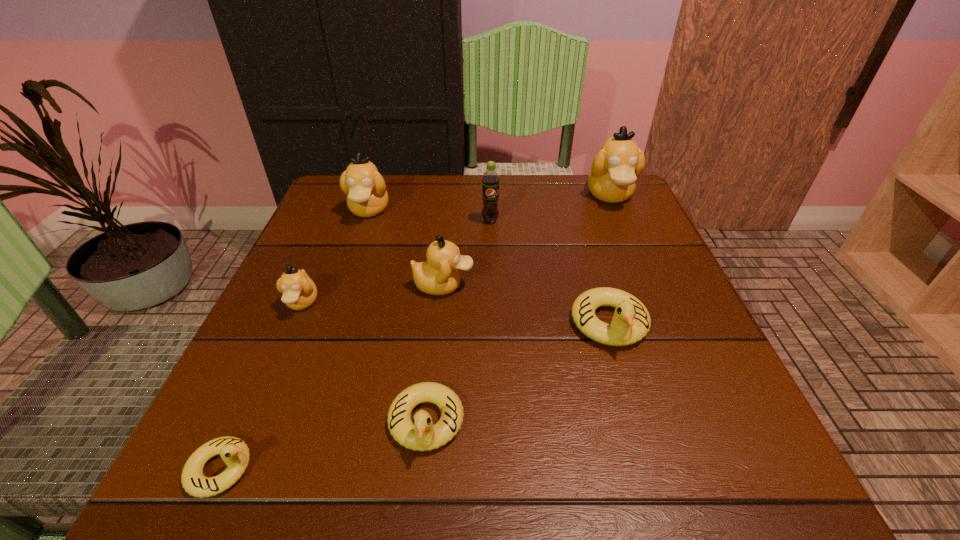
This screenshot has width=960, height=540. Find the location of `the second yellow duckling from right to left`. the second yellow duckling from right to left is located at coordinates coord(420,435).

At what (x,y) coordinates should I click in order to perform the action: click on the sixth tallest duckling. Please return your answer as a coordinate pair (x, y). Looking at the image, I should click on (420, 435).

The width and height of the screenshot is (960, 540). What are the coordinates of `the shortest duckling` in the screenshot? It's located at (234, 452).

Locate an element on the screen. This screenshot has height=540, width=960. the leftmost yellow duckling is located at coordinates (234, 452).

This screenshot has height=540, width=960. I want to click on vacant region located 0.280m on the face of the biggest tan duckling, so click(x=653, y=294).

Identify the location of free spot located 0.400m on the face of the second tallest duckling. Image resolution: width=960 pixels, height=540 pixels. (314, 368).

The height and width of the screenshot is (540, 960). Identify the location of free space located 0.370m on the front label of the green soda. (494, 350).

The width and height of the screenshot is (960, 540). I want to click on blank area located 0.100m on the face of the fifth shortest duckling, so click(x=524, y=286).

Locate an element on the screen. The width and height of the screenshot is (960, 540). vacant space situated 0.050m on the face of the biggest yellow duckling is located at coordinates point(627,382).

Where is `free spot located on the face of the smallest tan duckling`? This screenshot has width=960, height=540. free spot located on the face of the smallest tan duckling is located at coordinates (264, 390).